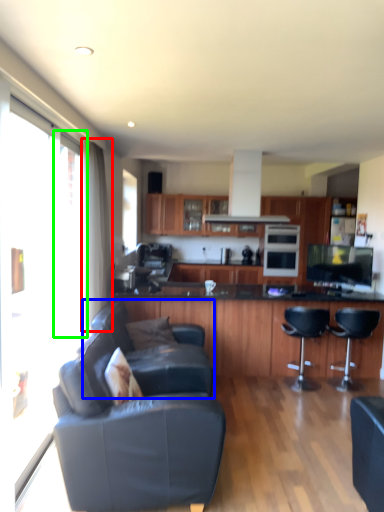
Question: Considering the real-world distances, which object is farthest from curtain (highlighted by a red box)? couch (highlighted by a blue box) or window (highlighted by a green box)?

Choices:
 (A) couch
 (B) window

Answer: (A)